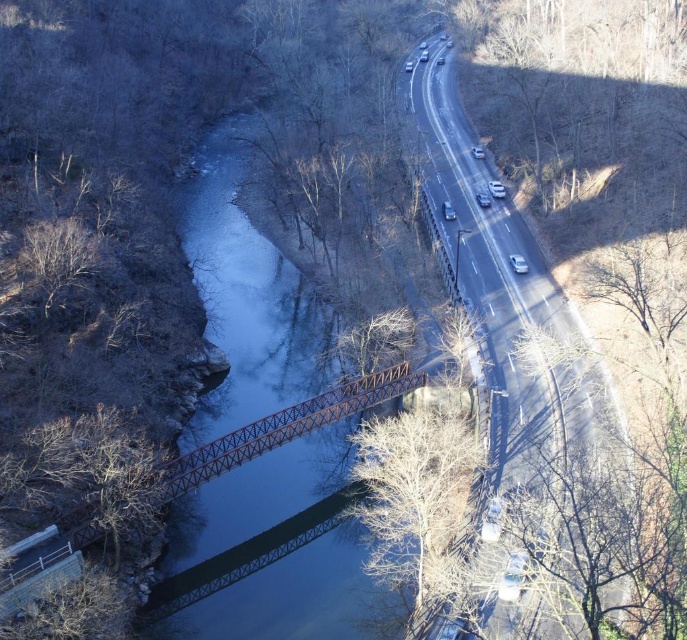
Question: Which point is farther to the camera?

Choices:
 (A) metallic blue river at center
 (B) rusty metal bridge at center

Answer: (A)

Question: Is metallic blue river at center further to the viewer compared to rusty metal bridge at center?

Choices:
 (A) yes
 (B) no

Answer: (A)

Question: Can you confirm if metallic blue river at center is positioned to the right of rusty metal bridge at center?

Choices:
 (A) yes
 (B) no

Answer: (B)

Question: Is metallic blue river at center closer to the viewer compared to rusty metal bridge at center?

Choices:
 (A) no
 (B) yes

Answer: (A)

Question: Which point is farther to the camera?

Choices:
 (A) (243, 164)
 (B) (240, 433)

Answer: (A)